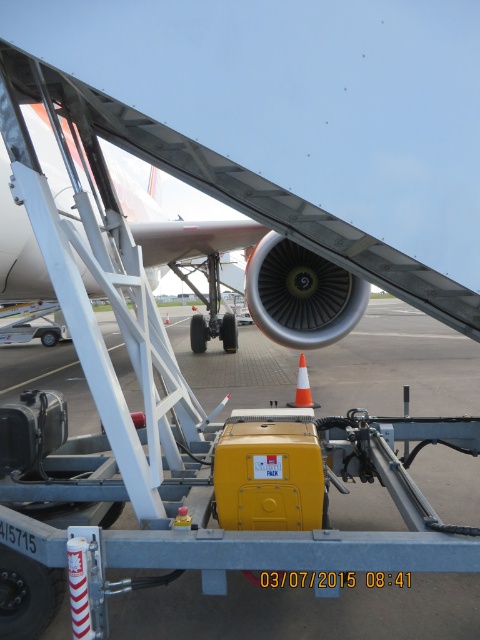
Question: Can you confirm if orange matte traffic cone at center is positioned above orange cone at center?

Choices:
 (A) no
 (B) yes

Answer: (A)

Question: Is metallic silver airplane at center thinner than orange cone at center?

Choices:
 (A) no
 (B) yes

Answer: (A)

Question: Is metallic silver airplane at center to the right of orange matte traffic cone at center from the viewer's perspective?

Choices:
 (A) no
 (B) yes

Answer: (A)

Question: Which object is the farthest from the orange cone at center?

Choices:
 (A) orange matte traffic cone at center
 (B) metallic silver airplane at center

Answer: (B)

Question: Which of the following is the closest to the observer?

Choices:
 (A) (168, 314)
 (B) (248, 186)
 (C) (302, 403)

Answer: (B)

Question: Which object is farther from the camera taking this photo?

Choices:
 (A) orange cone at center
 (B) orange matte traffic cone at center
 (C) metallic silver airplane at center

Answer: (A)